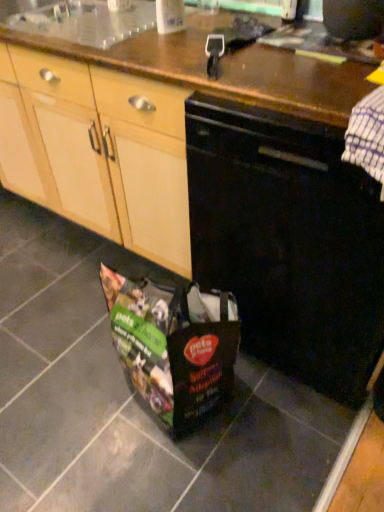
You are a GUI agent. You are given a task and a screenshot of the screen. Output one action in this format:
    pyautogui.click(x=<x>, y=<y>)
    Task: Click on the free region on the left part of white glossy container at upper center
    
    Given the screenshot: What is the action you would take?
    pyautogui.click(x=110, y=40)